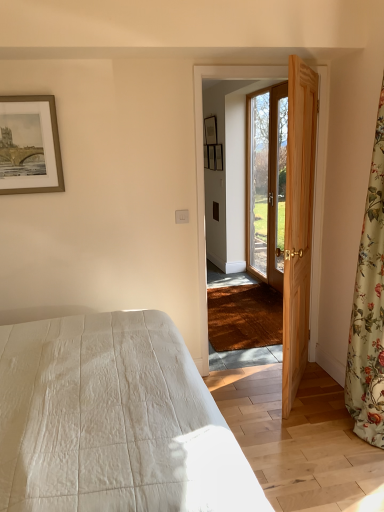
You are a GUI agent. You are given a task and a screenshot of the screen. Output one action in this format:
    pyautogui.click(x=<x>, y=<y>)
    Task: Click on the floral fabric curtain at right
    This screenshot has height=512, width=384.
    Given the screenshot: What is the action you would take?
    pyautogui.click(x=369, y=308)

I want to click on wooden picture frame at center, which ranks as the 4th picture frame in front-to-back order, so click(x=212, y=157).

Identify the location of matte wooden picture frame at upper center, the fourth picture frame when ordered from left to right. (219, 157).

The width and height of the screenshot is (384, 512). Find the location of `wooden screen door at center`. wooden screen door at center is located at coordinates (298, 224).

This screenshot has width=384, height=512. What do you see at coordinates (113, 421) in the screenshot?
I see `white quilted bed at lower left` at bounding box center [113, 421].

Measure the distance between white quilted bed at lower left and camera.

They are 3.31 feet apart.

Find the location of `gold-framed artwork at upper left, arranged as the 1th picture frame when viewed from the left`. gold-framed artwork at upper left, arranged as the 1th picture frame when viewed from the left is located at coordinates (29, 145).

Which is behind, point (215, 161) or point (289, 252)?

Positioned behind is point (215, 161).

Can you confirm if wooden picture frame at center, acting as the second picture frame starting from the right, is wider than natural wood door at right, the second door viewed from the back?

No, wooden picture frame at center, acting as the second picture frame starting from the right, is not wider than natural wood door at right, the second door viewed from the back.

Can we say wooden picture frame at center, the 2th picture frame when ordered from top to bottom, lies outside natural wood door at right, arranged as the 1th door when viewed from the front?

wooden picture frame at center, the 2th picture frame when ordered from top to bottom, is positioned outside natural wood door at right, arranged as the 1th door when viewed from the front.

Could you tell me if wooden picture frame at center, acting as the second picture frame starting from the right, is facing natural wood door at right, the second door viewed from the back?

No.

Does wooden door at right, which appears as the 1th door when viewed from the back, touch natural wood door at right, arranged as the 1th door when viewed from the front?

No, wooden door at right, which appears as the 1th door when viewed from the back, is not in contact with natural wood door at right, arranged as the 1th door when viewed from the front.

From the image's perspective, is wooden door at right, which appears as the 1th door when viewed from the back, under natural wood door at right, the second door viewed from the back?

No.

Is wooden door at right, which is the 2th door in front-to-back order, oriented away from natural wood door at right, arranged as the 1th door when viewed from the front?

That's not correct — wooden door at right, which is the 2th door in front-to-back order, is not looking away from natural wood door at right, arranged as the 1th door when viewed from the front.

Does wooden door at right, which is the 2th door in front-to-back order, have a lesser width compared to natural wood door at right, the second door viewed from the back?

Yes.

Is wooden door at right, which appears as the 1th door when viewed from the back, oriented away from floral fabric curtain at right?

That's not correct — wooden door at right, which appears as the 1th door when viewed from the back, is not looking away from floral fabric curtain at right.

The height and width of the screenshot is (512, 384). In order to click on curtain on the right of the wooden door at right, which is the 2th door in front-to-back order in this screenshot , I will do `click(369, 308)`.

Considering the points (279, 92) and (383, 242), which point is in front, point (279, 92) or point (383, 242)?

Positioned in front is point (383, 242).

Can you tell me how much wooden door at right, which is the 2th door in front-to-back order, and floral fabric curtain at right differ in facing direction?

The angle between the facing direction of wooden door at right, which is the 2th door in front-to-back order, and the facing direction of floral fabric curtain at right is 1.08 degrees.

Which is nearer, (285, 326) or (22, 180)?

Clearly, point (285, 326) is closer to the camera than point (22, 180).

Is wooden screen door at center not inside gold-framed artwork at upper left, which appears as the 4th picture frame when viewed from the top?

wooden screen door at center lies outside gold-framed artwork at upper left, which appears as the 4th picture frame when viewed from the top,'s area.

Is there a large distance between wooden screen door at center and gold-framed artwork at upper left, which appears as the 4th picture frame when viewed from the top?

Absolutely, wooden screen door at center is distant from gold-framed artwork at upper left, which appears as the 4th picture frame when viewed from the top.

How distant is wooden screen door at center from gold-framed artwork at upper left, arranged as the first picture frame when ordered from the bottom?

wooden screen door at center is 1.16 meters away from gold-framed artwork at upper left, arranged as the first picture frame when ordered from the bottom.

Considering their positions, is wooden screen door at center located in front of or behind white quilted bed at lower left?

In the image, wooden screen door at center appears behind white quilted bed at lower left.

Which point is more distant from viewer, (195, 124) or (83, 425)?

The point (195, 124) is more distant.

I want to click on bed on the left of wooden screen door at center, so click(113, 421).

In the scene shown: Considering the positions of objects wooden screen door at center and white quilted bed at lower left in the image provided, who is more to the right, wooden screen door at center or white quilted bed at lower left?

Positioned to the right is wooden screen door at center.

Does white quilted bed at lower left have a larger size compared to matte wooden picture frame at upper center, which is the second picture frame from front to back?

Indeed, white quilted bed at lower left has a larger size compared to matte wooden picture frame at upper center, which is the second picture frame from front to back.

Is white quilted bed at lower left to the left of matte wooden picture frame at upper center, the 3th picture frame positioned from the top, from the viewer's perspective?

Correct, you'll find white quilted bed at lower left to the left of matte wooden picture frame at upper center, the 3th picture frame positioned from the top.

Is matte wooden picture frame at upper center, the first picture frame positioned from the right, a part of white quilted bed at lower left?

No, matte wooden picture frame at upper center, the first picture frame positioned from the right, is located outside of white quilted bed at lower left.

In terms of size, does wooden door at right, which appears as the 1th door when viewed from the back, appear bigger or smaller than white quilted bed at lower left?

In the image, wooden door at right, which appears as the 1th door when viewed from the back, appears to be smaller than white quilted bed at lower left.

Is wooden door at right, which is the 2th door in front-to-back order, far away from white quilted bed at lower left?

wooden door at right, which is the 2th door in front-to-back order, is far away from white quilted bed at lower left.

Is wooden door at right, which appears as the 1th door when viewed from the back, to the left or to the right of white quilted bed at lower left in the image?

From the image, it's evident that wooden door at right, which appears as the 1th door when viewed from the back, is to the right of white quilted bed at lower left.

Is wooden door at right, which is the 2th door in front-to-back order, completely or partially outside of white quilted bed at lower left?

Yes.

From a real-world perspective, starting from the wooden picture frame at center, which ranks as the 4th picture frame in front-to-back order, which door is the 2nd one below it? Please provide its 2D coordinates.

[(298, 224)]

This screenshot has height=512, width=384. I want to click on door that appears on the right of natural wood door at right, arranged as the 1th door when viewed from the front, so click(x=266, y=182).

Looking at the image, which one is located further to white quilted bed at lower left, wooden picture frame at center, arranged as the 3th picture frame when viewed from the left, or floral fabric curtain at right?

Based on the image, wooden picture frame at center, arranged as the 3th picture frame when viewed from the left, appears to be further to white quilted bed at lower left.

In the scene shown: From the image, which object appears to be nearer to floral fabric curtain at right, wooden door at right, which appears as the 1th door when viewed from the back, or natural wood door at right, arranged as the 1th door when viewed from the front?

natural wood door at right, arranged as the 1th door when viewed from the front, is closer to floral fabric curtain at right.

Considering their positions, is gold-framed artwork at upper left, which ranks as the 4th picture frame in right-to-left order, positioned further to wooden picture frame at center, the 2th picture frame when ordered from top to bottom, than matte wooden picture frame at upper center, the fourth picture frame when ordered from left to right?

The object further to wooden picture frame at center, the 2th picture frame when ordered from top to bottom, is gold-framed artwork at upper left, which ranks as the 4th picture frame in right-to-left order.

When comparing their distances from matte black picture frame at upper center, the third picture frame in the right-to-left sequence, does white quilted bed at lower left or matte wooden picture frame at upper center, acting as the 3th picture frame starting from the back, seem further?

white quilted bed at lower left is further to matte black picture frame at upper center, the third picture frame in the right-to-left sequence.

From the image, which object appears to be nearer to wooden picture frame at center, the 1th picture frame viewed from the back, wooden door at right, which is the 2th door in front-to-back order, or natural wood door at right, the second door viewed from the back?

Among the two, wooden door at right, which is the 2th door in front-to-back order, is located nearer to wooden picture frame at center, the 1th picture frame viewed from the back.

When comparing their distances from matte wooden picture frame at upper center, which is the second picture frame from bottom to top, does white quilted bed at lower left or wooden screen door at center seem closer?

wooden screen door at center is closer to matte wooden picture frame at upper center, which is the second picture frame from bottom to top.

Which object lies further to the anchor point matte black picture frame at upper center, the third picture frame in the right-to-left sequence, wooden screen door at center or wooden picture frame at center, the 1th picture frame viewed from the back?

Among the two, wooden screen door at center is located further to matte black picture frame at upper center, the third picture frame in the right-to-left sequence.

Estimate the real-world distances between objects in this image. Which object is closer to floral fabric curtain at right, wooden door at right, which appears as the 1th door when viewed from the back, or wooden screen door at center?

wooden screen door at center lies closer to floral fabric curtain at right than the other object.

Where is `door between white quilted bed at lower left and gold-framed artwork at upper left, arranged as the 1th picture frame when viewed from the left, in the front-back direction`? door between white quilted bed at lower left and gold-framed artwork at upper left, arranged as the 1th picture frame when viewed from the left, in the front-back direction is located at coordinates (298, 224).

The width and height of the screenshot is (384, 512). What are the coordinates of `picture frame between floral fabric curtain at right and wooden door at right, which is the 2th door in front-to-back order, along the z-axis` in the screenshot? It's located at (29, 145).

Locate an element on the screen. picture frame between wooden door at right, which appears as the 1th door when viewed from the back, and matte black picture frame at upper center, which is the 2th picture frame from back to front, from front to back is located at coordinates (219, 157).

Where is `screen door located between white quilted bed at lower left and matte black picture frame at upper center, acting as the fourth picture frame starting from the bottom, in the depth direction`? This screenshot has width=384, height=512. screen door located between white quilted bed at lower left and matte black picture frame at upper center, acting as the fourth picture frame starting from the bottom, in the depth direction is located at coordinates (298, 224).